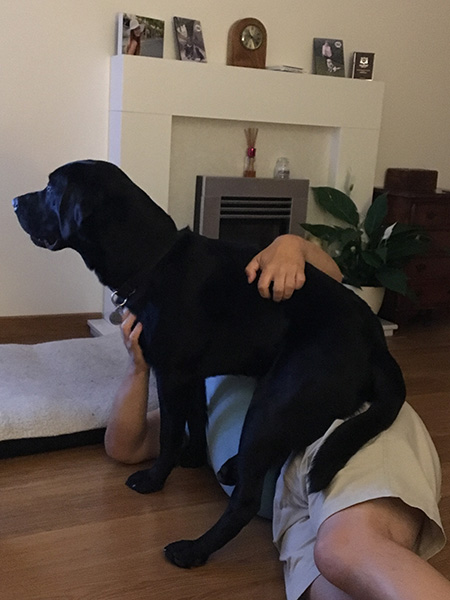
At what (x,y) coordinates should I click in order to perform the action: click on candle. Please return your answer as a coordinate pair (x, y). Image resolution: width=450 pixels, height=600 pixels. Looking at the image, I should click on (284, 171).